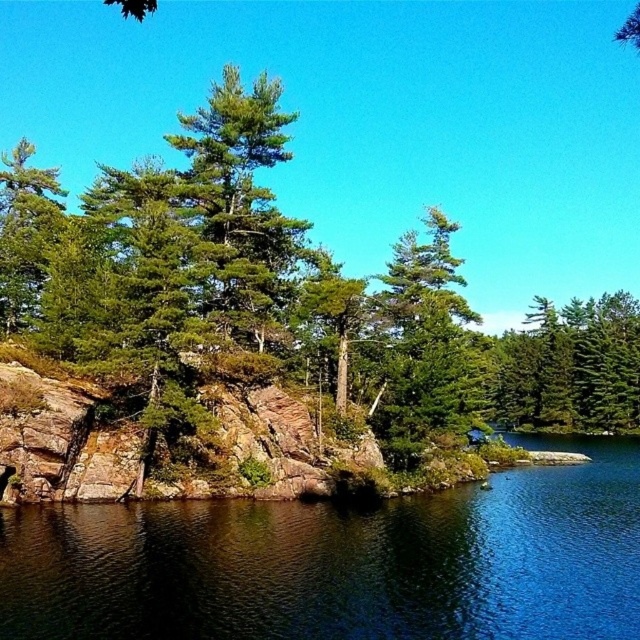
You are standing at the origin point of the coordinate system in the image. You want to place a small decorative stone exactly at the location of the green textured rock at center. What coordinates should you aim for?

The coordinates to aim for are 0.466 on the x axis and 0.448 on the y axis, as the green textured rock at center is located at point 0.448.